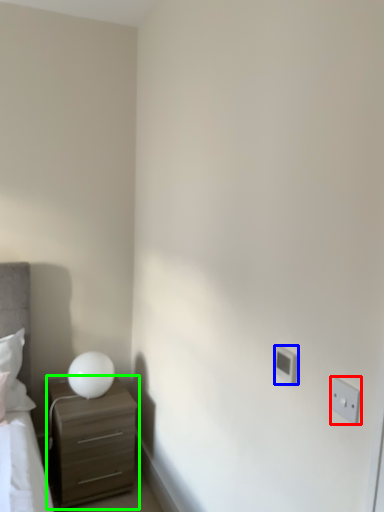
Question: Considering the real-world distances, which object is farthest from electric outlet (highlighted by a red box)? electric outlet (highlighted by a blue box) or chest of drawers (highlighted by a green box)?

Choices:
 (A) electric outlet
 (B) chest of drawers

Answer: (B)